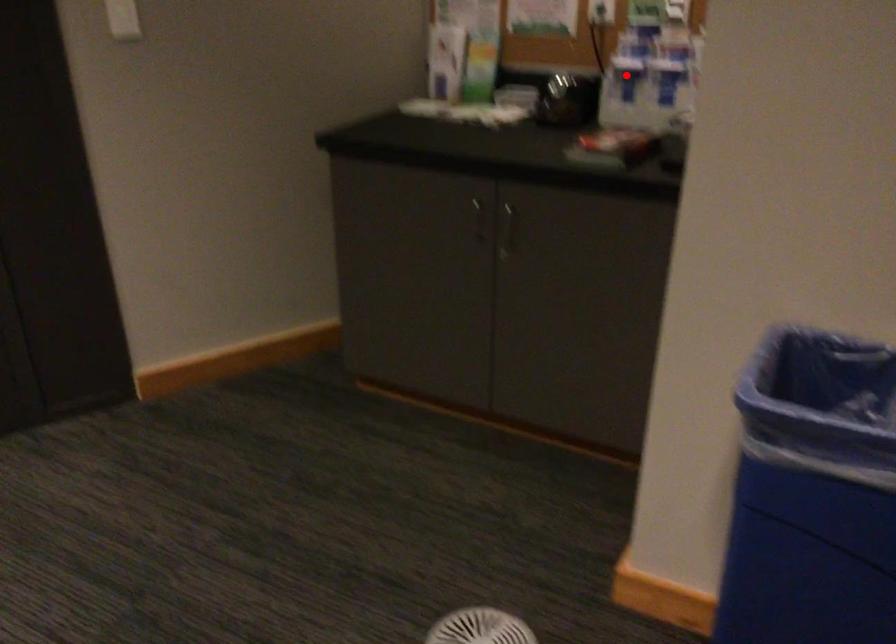
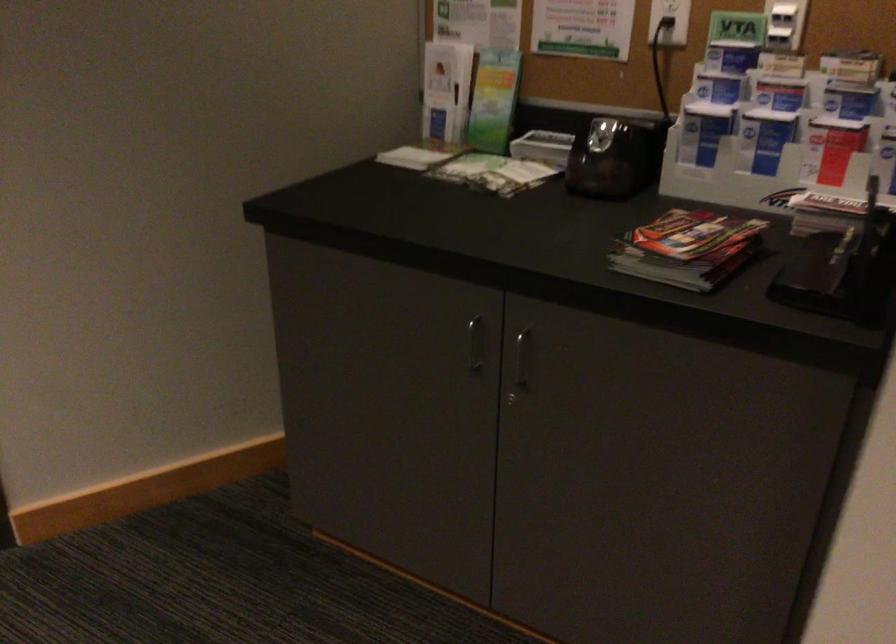
Find the pixel in the second image that matches the highlighted location in the first image.

(702, 131)